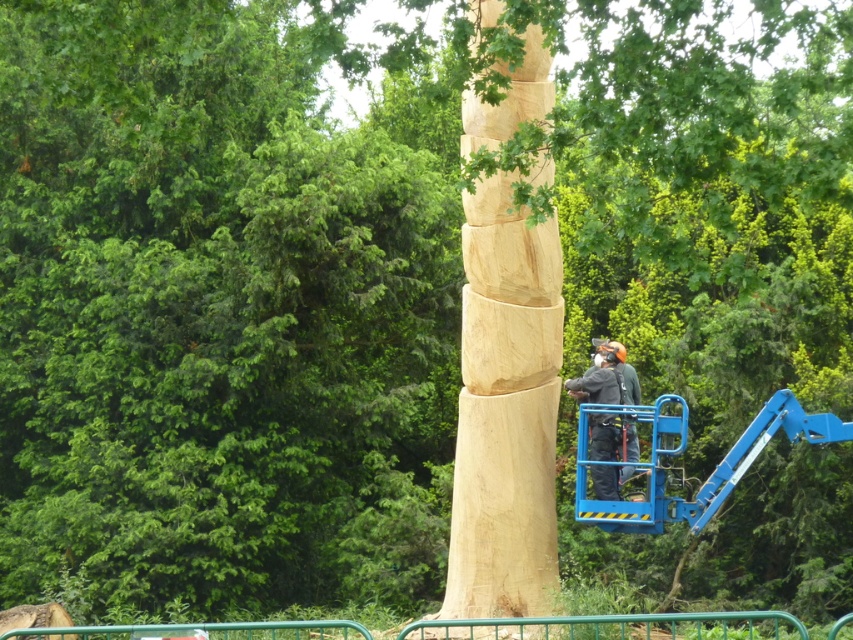
Question: Can you confirm if natural wood tree trunk at center is positioned below wooden helmet at center?

Choices:
 (A) yes
 (B) no

Answer: (B)

Question: Which point is closer to the camera?

Choices:
 (A) (526, 509)
 (B) (579, 380)

Answer: (B)

Question: Is natural wood tree trunk at center thinner than wooden helmet at center?

Choices:
 (A) no
 (B) yes

Answer: (B)

Question: Among these points, which one is farthest from the camera?

Choices:
 (A) (498, 337)
 (B) (618, 436)

Answer: (A)

Question: Does natural wood tree trunk at center have a smaller size compared to wooden helmet at center?

Choices:
 (A) no
 (B) yes

Answer: (B)

Question: Which object appears closest to the camera in this image?

Choices:
 (A) wooden helmet at center
 (B) natural wood tree trunk at center

Answer: (A)